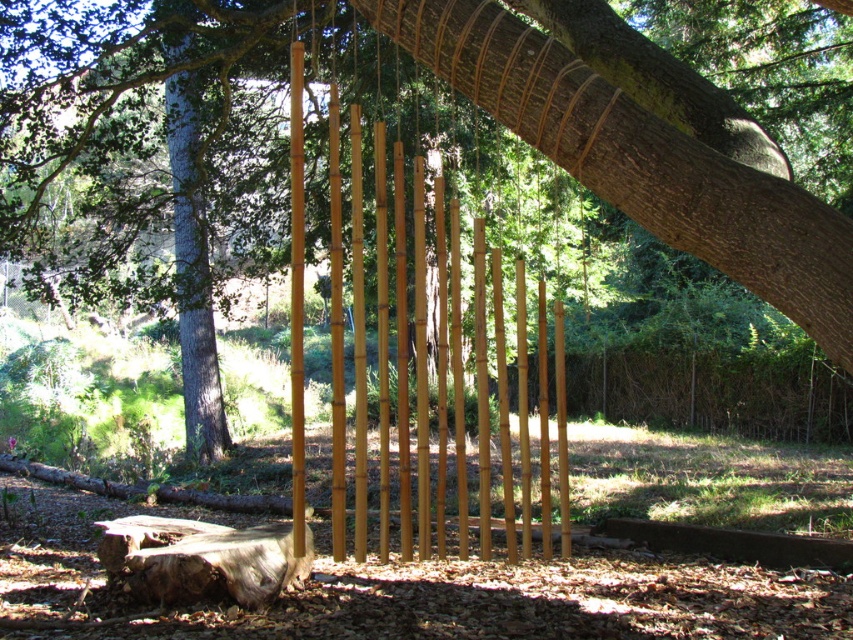
Is natural bamboo wind chime at center bigger than smooth gray bark at center?

Correct, natural bamboo wind chime at center is larger in size than smooth gray bark at center.

Between point (666, 168) and point (177, 284), which one is positioned behind?

Positioned behind is point (177, 284).

What do you see at coordinates (643, 141) in the screenshot? The height and width of the screenshot is (640, 853). I see `natural bamboo wind chime at center` at bounding box center [643, 141].

Locate an element on the screen. This screenshot has width=853, height=640. natural bamboo wind chime at center is located at coordinates 643,141.

Which is more to the right, brown wooden fence at center or smooth gray bark at center?

Positioned to the right is brown wooden fence at center.

Does brown wooden fence at center appear on the left side of smooth gray bark at center?

In fact, brown wooden fence at center is to the right of smooth gray bark at center.

Is point (834, 410) behind point (219, 416)?

Yes, point (834, 410) is behind point (219, 416).

Find the location of a particular element. The height and width of the screenshot is (640, 853). brown wooden fence at center is located at coordinates point(712,392).

Does natural bamboo wind chime at center appear on the left side of brown wooden fence at center?

Correct, you'll find natural bamboo wind chime at center to the left of brown wooden fence at center.

Does natural bamboo wind chime at center have a smaller size compared to brown wooden fence at center?

No.

Does point (827, 323) come farther from viewer compared to point (618, 374)?

No, it is in front of (618, 374).

You are a GUI agent. You are given a task and a screenshot of the screen. Output one action in this format:
    pyautogui.click(x=<x>, y=<y>)
    Task: Click on the natural bamboo wind chime at center
    
    Given the screenshot: What is the action you would take?
    pyautogui.click(x=643, y=141)